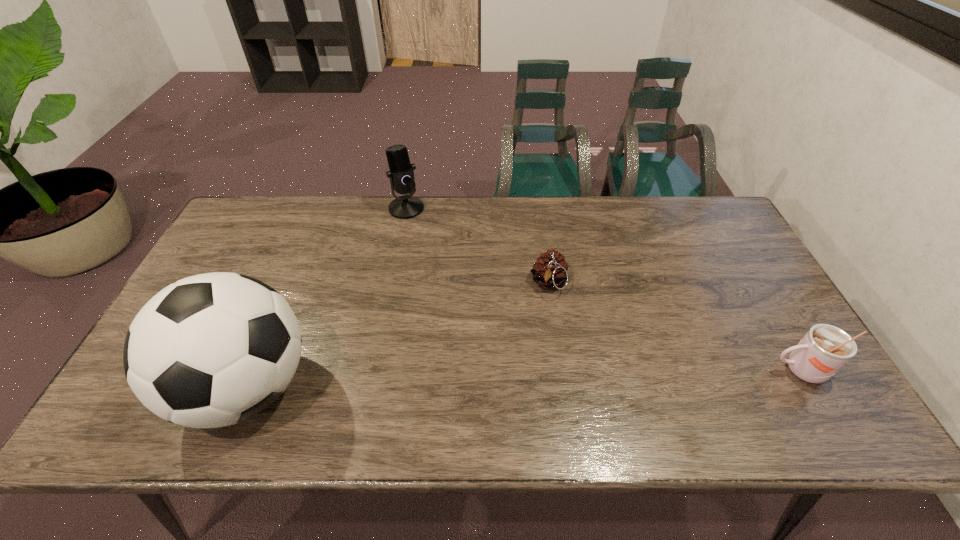
The image size is (960, 540). I want to click on vacant position in the image that satisfies the following two spatial constraints: 1. on the back side of the microphone; 2. on the right side of the leftmost object, so click(321, 208).